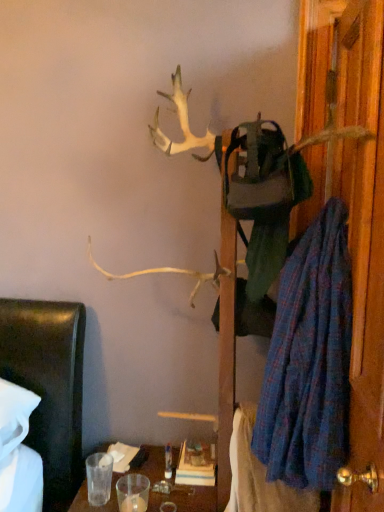
Question: Considering the positions of blue plaid robe at right and blue plaid blanket at lower right in the image, is blue plaid robe at right bigger or smaller than blue plaid blanket at lower right?

Choices:
 (A) big
 (B) small

Answer: (A)

Question: From the image's perspective, is blue plaid robe at right above or below blue plaid blanket at lower right?

Choices:
 (A) above
 (B) below

Answer: (A)

Question: Which is farther from the wooden door at right?

Choices:
 (A) blue plaid robe at right
 (B) blue plaid blanket at lower right

Answer: (B)

Question: Which object is positioned closest to the wooden door at right?

Choices:
 (A) blue plaid blanket at lower right
 (B) blue plaid robe at right

Answer: (B)